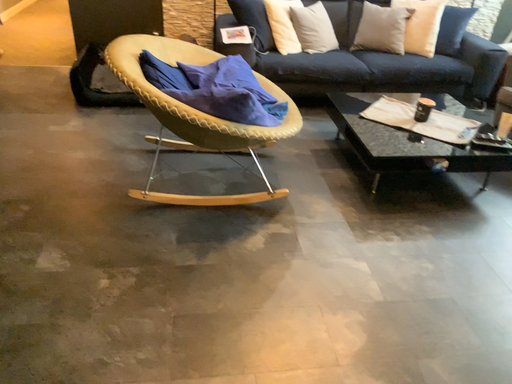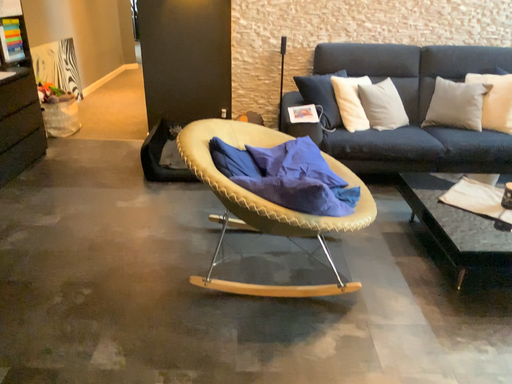
Question: Which way did the camera rotate in the video?

Choices:
 (A) rotated upward
 (B) rotated downward

Answer: (A)